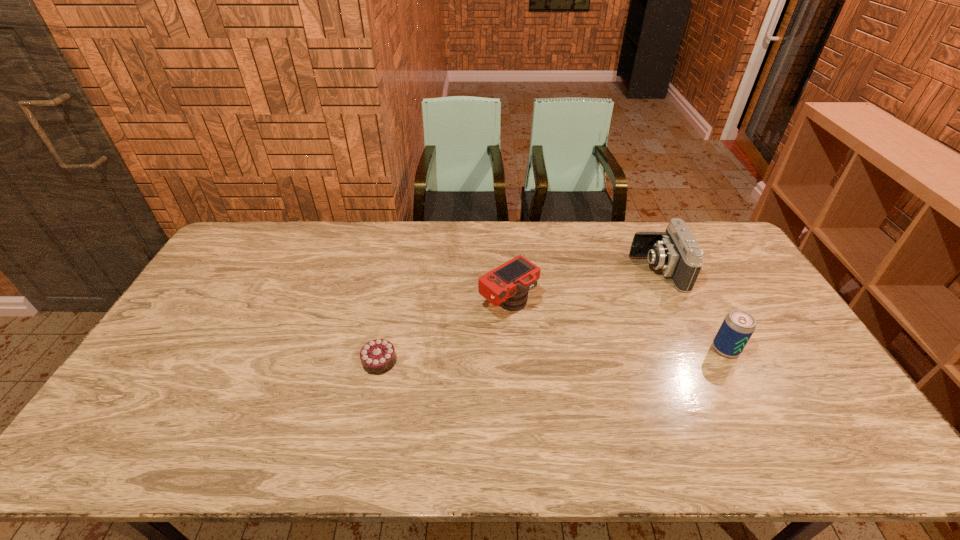
Find the location of a particular element. The image size is (960, 540). blank space located 0.170m on the right of the leftmost object is located at coordinates (457, 361).

Where is `object positioned at the far edge`? The width and height of the screenshot is (960, 540). object positioned at the far edge is located at coordinates (676, 252).

In order to click on vacant space at the far edge of the desktop in this screenshot , I will do `click(398, 233)`.

The height and width of the screenshot is (540, 960). In the image, there is a desktop. What are the coordinates of `free space at the near edge` in the screenshot? It's located at coord(201,438).

The width and height of the screenshot is (960, 540). I want to click on vacant space at the left edge, so click(x=228, y=269).

The width and height of the screenshot is (960, 540). What are the coordinates of `free space at the right edge of the desktop` in the screenshot? It's located at (730, 295).

Find the location of a particular element. free space between the chocolate cake and the right camera is located at coordinates (518, 316).

Locate an element on the screen. vacant area between the shortest object and the beer can is located at coordinates (552, 355).

At what (x,y) coordinates should I click in order to perform the action: click on free space between the leftmost object and the right camera. Please return your answer as a coordinate pair (x, y). Looking at the image, I should click on (518, 316).

This screenshot has height=540, width=960. In order to click on vacant space that is in between the beer can and the leftmost object in this screenshot , I will do `click(552, 355)`.